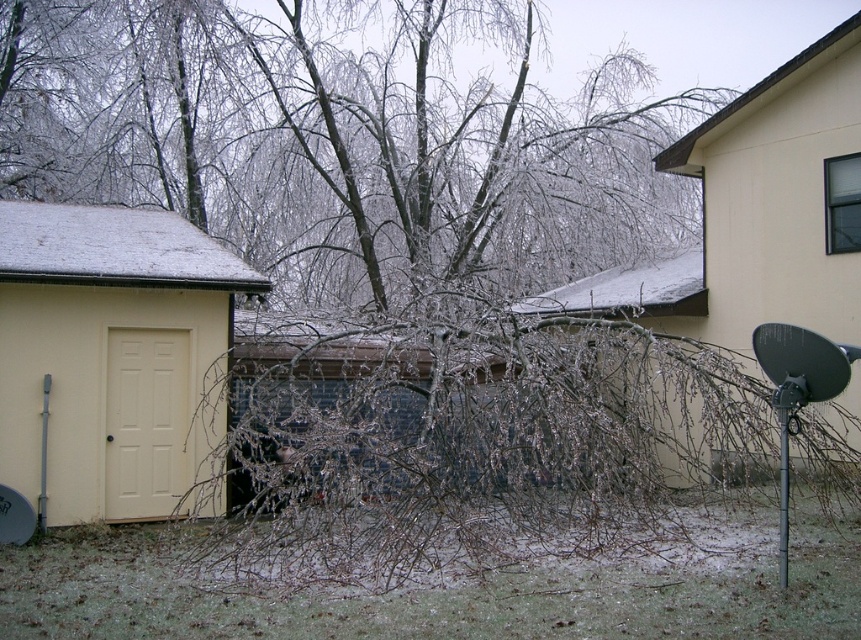
You are a delivery person trying to reach the yellow matte door at left. There are frosted branches at center in your way. Can you walk around them to reach the door?

The frosted branches at center are to the right of the yellow matte door at left, so you can walk around them to reach the door by moving to the left side of the branches.

You are a delivery person trying to navigate through the icy path between the frozen wood branches at center and the frosted branches at center. Which branches are closer to you as you approach the scene?

The frozen wood branches at center are closer to you than the frosted branches at center because they are further to the viewer.

You are a delivery person trying to reach the yellow matte door at left. There are frozen wood branches at center blocking the path. Can you walk through the space between them?

The frozen wood branches at center are narrower than the yellow matte door at left, so there is enough space to walk through the path between them.